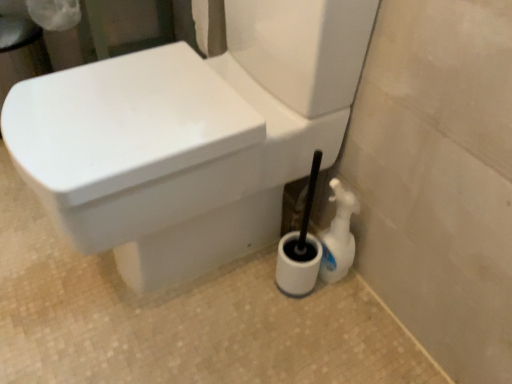
Identify the location of vacant area that lies to the right of white plastic spray bottle at lower right. (369, 292).